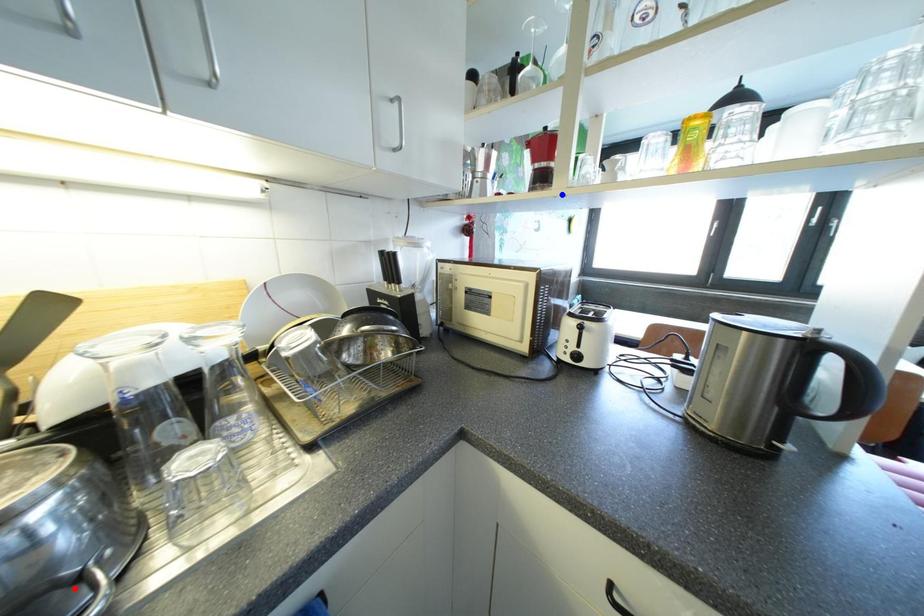
Question: In the image, two points are highlighted. Which point is nearer to the camera? Reply with the corresponding letter.

Choices:
 (A) blue point
 (B) red point

Answer: (B)